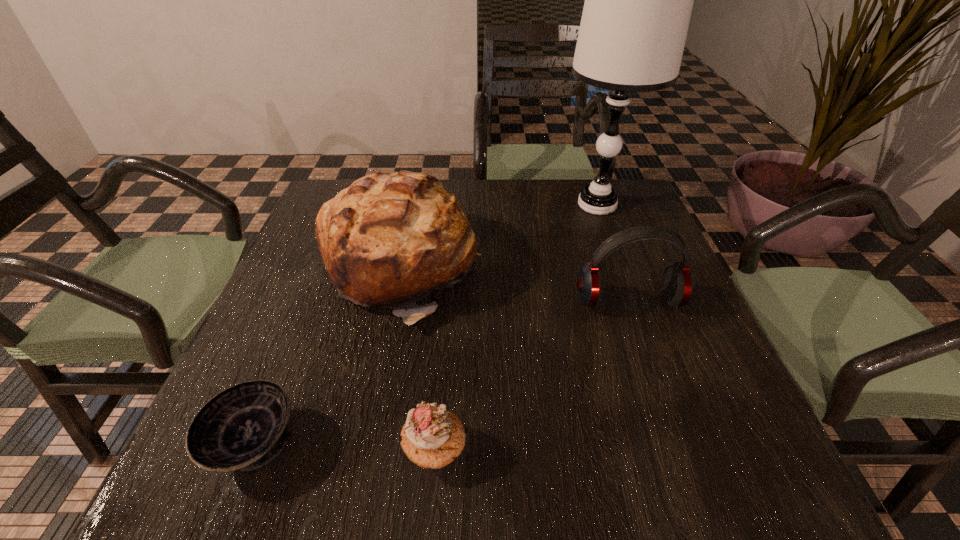
Image resolution: width=960 pixels, height=540 pixels. I want to click on table lamp, so click(x=638, y=2).

Identify the location of bread. The width and height of the screenshot is (960, 540). (388, 240).

Identify the location of earphone. This screenshot has width=960, height=540. (677, 282).

Locate an element on the screen. This screenshot has width=960, height=540. the second shortest object is located at coordinates (432, 437).

You are a GUI agent. You are given a task and a screenshot of the screen. Output one action in this format:
    pyautogui.click(x=<x>, y=<y>)
    Task: Click on the bowl
    Image resolution: width=960 pixels, height=540 pixels.
    Given the screenshot: What is the action you would take?
    pyautogui.click(x=243, y=428)

Where is `vacant space located 0.340m on the left of the table lamp`? The height and width of the screenshot is (540, 960). vacant space located 0.340m on the left of the table lamp is located at coordinates (435, 205).

Where is `vacant space located on the front of the bread`? Image resolution: width=960 pixels, height=540 pixels. vacant space located on the front of the bread is located at coordinates (370, 406).

The image size is (960, 540). Find the location of `vacant space located on the ear cups of the earphone`. vacant space located on the ear cups of the earphone is located at coordinates (656, 376).

Where is `free space located on the back of the second shortest object`? The height and width of the screenshot is (540, 960). free space located on the back of the second shortest object is located at coordinates (442, 364).

Find the location of a particular element. The width and height of the screenshot is (960, 540). vacant region located on the right of the bowl is located at coordinates (509, 444).